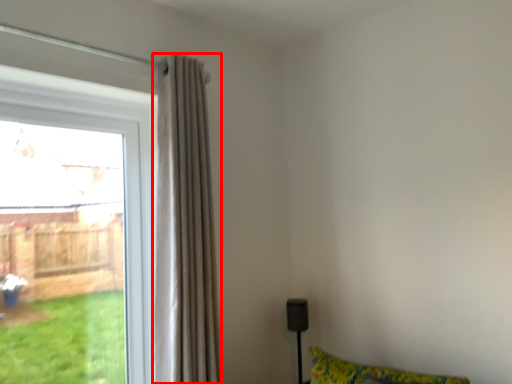
Question: From the image's perspective, what is the correct spatial positioning of curtain (annotated by the red box) in reference to window?

Choices:
 (A) below
 (B) above

Answer: (B)